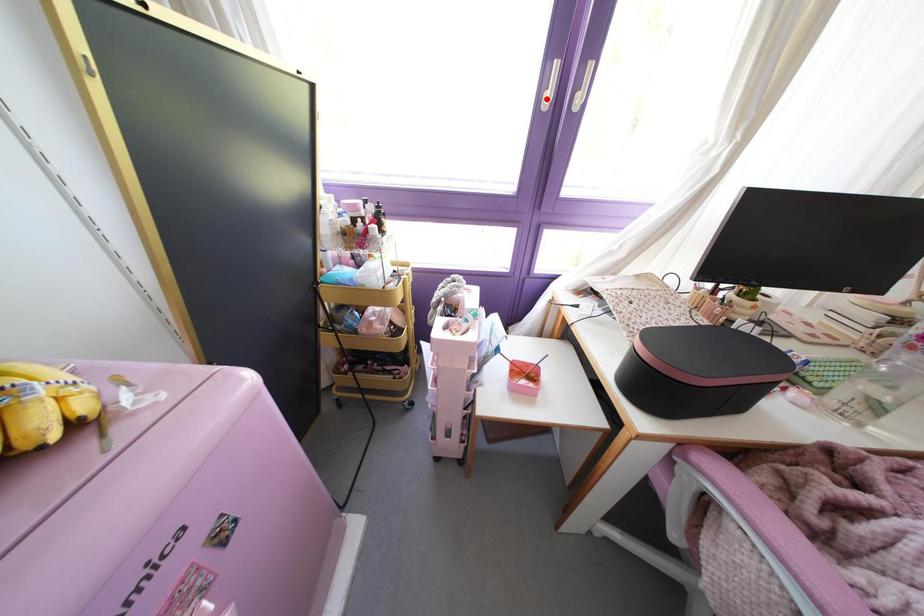
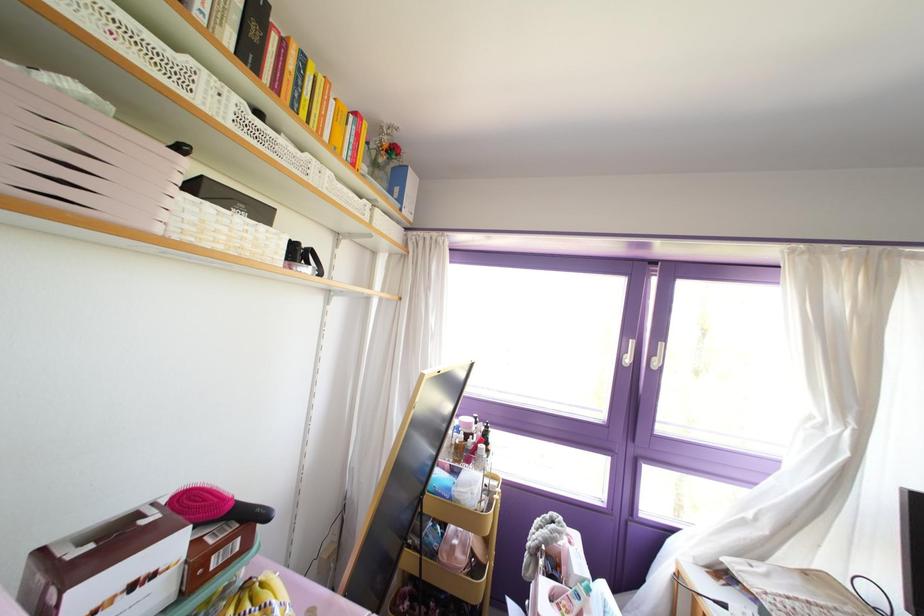
Question: I am providing you with two images of the same scene from different viewpoints. Image1 has a red point marked. In image2, the corresponding 3D location appears at what relative position? Reply with the corresponding letter.

Choices:
 (A) Closer
 (B) Farther

Answer: (B)